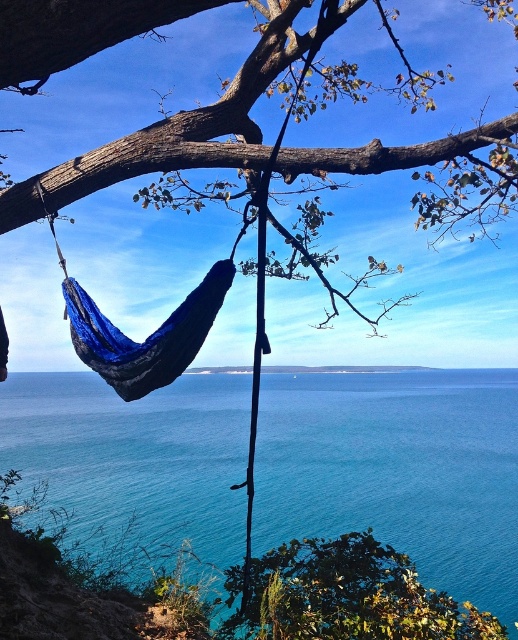
You are standing in the scene and want to walk from the blue knitted hammock at lower left to the green leafy tree at lower center. Which direction should you move relative to the hammock?

To reach the green leafy tree at lower center from the blue knitted hammock at lower left, you should move to the right since the green leafy tree at lower center is positioned to the right of the blue knitted hammock at lower left.

You are planning to take a photo of the blue water at center and the green leafy tree at lower center. Which object appears wider in the image?

The blue water at center appears wider than the green leafy tree at lower center because its width surpasses the tree.

You are standing on the dock and see the blue water at center and the green leafy tree at lower center. Which object is closer to you?

The green leafy tree at lower center is closer to you because it is positioned under the blue water at center.